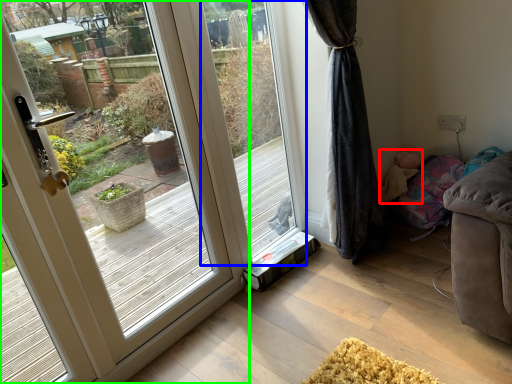
Question: Based on their relative distances, which object is nearer to child (highlighted by a red box)? Choose from window screen (highlighted by a blue box) and door (highlighted by a green box).

Choices:
 (A) window screen
 (B) door

Answer: (A)